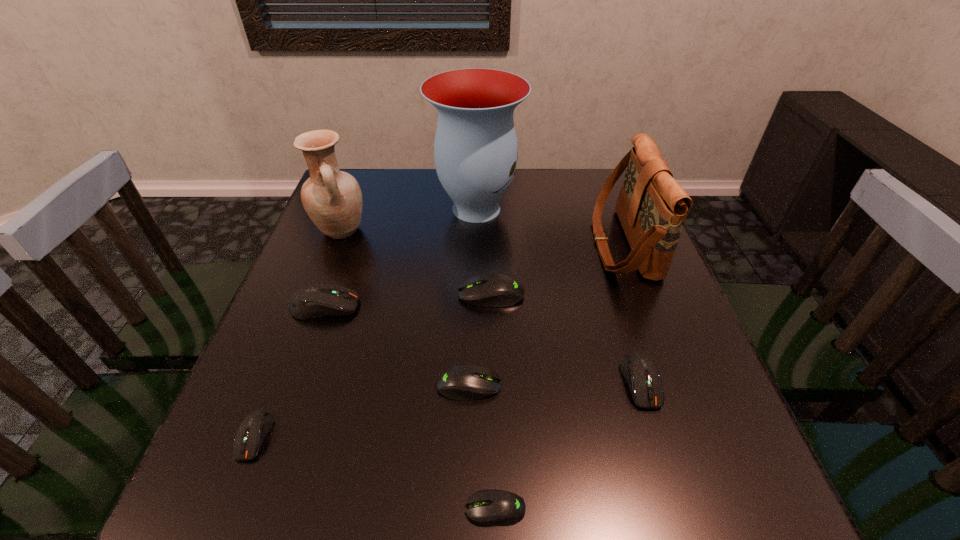
Where is `object positioned at the near edge`? The image size is (960, 540). object positioned at the near edge is located at coordinates (493, 507).

The height and width of the screenshot is (540, 960). I want to click on pottery at the left edge, so click(x=332, y=198).

Image resolution: width=960 pixels, height=540 pixels. In order to click on shoulder bag positioned at the right edge in this screenshot , I will do `click(652, 207)`.

Locate an element on the screen. This screenshot has width=960, height=540. computer equipment that is at the right edge is located at coordinates (640, 372).

At what (x,y) coordinates should I click in order to perform the action: click on object that is at the far right corner. Please return your answer as a coordinate pair (x, y). Looking at the image, I should click on (652, 207).

Identify the location of free space at the far edge of the desktop. The width and height of the screenshot is (960, 540). (423, 184).

Identify the location of free spot at the near edge of the desktop. The width and height of the screenshot is (960, 540). (396, 514).

Image resolution: width=960 pixels, height=540 pixels. In the image, there is a desktop. In order to click on vacant space at the left edge in this screenshot , I will do tap(303, 253).

Locate an element on the screen. The height and width of the screenshot is (540, 960). free space at the right edge of the desktop is located at coordinates (677, 401).

Where is `vacant space at the far right corner`? The width and height of the screenshot is (960, 540). vacant space at the far right corner is located at coordinates (623, 177).